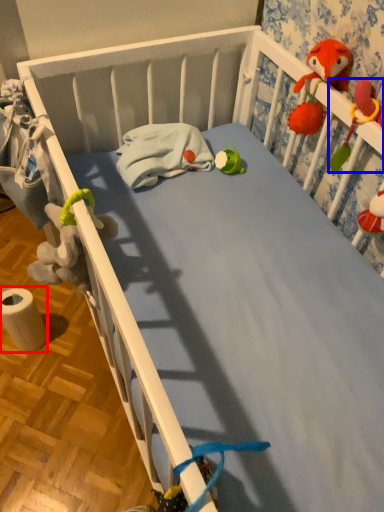
Question: Which object is closer to the camera taking this photo, toilet paper (highlighted by a red box) or toy (highlighted by a blue box)?

Choices:
 (A) toilet paper
 (B) toy

Answer: (B)